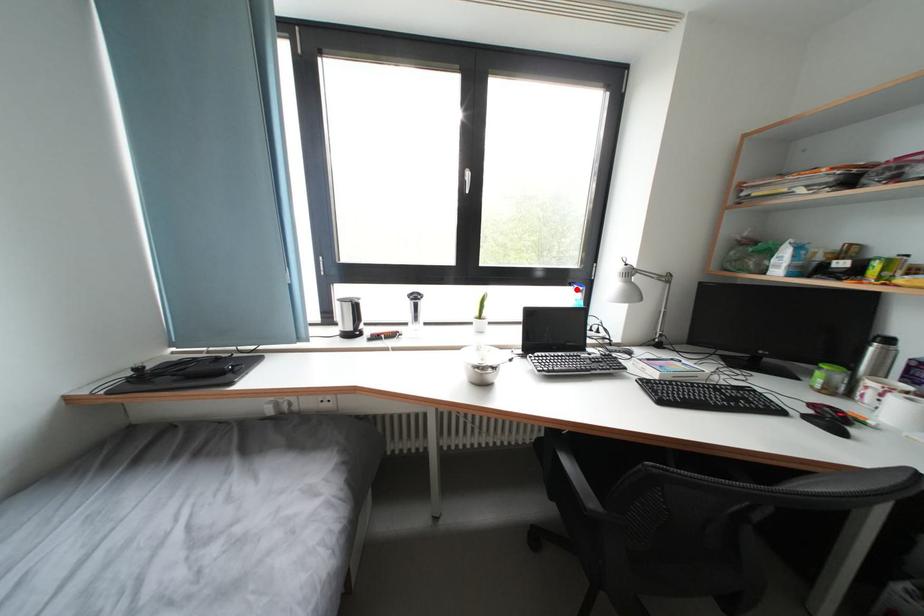
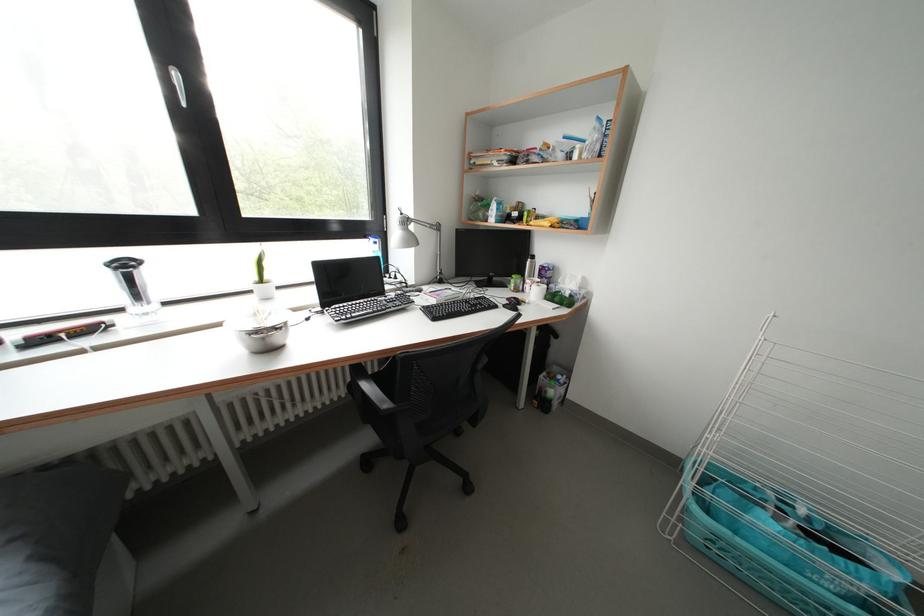
Question: A red point is marked in image1. In image2, is the corresponding 3D point closer to the camera or farther? Reply with the corresponding letter.

Choices:
 (A) The corresponding 3D point is closer.
 (B) The corresponding 3D point is farther.

Answer: (A)